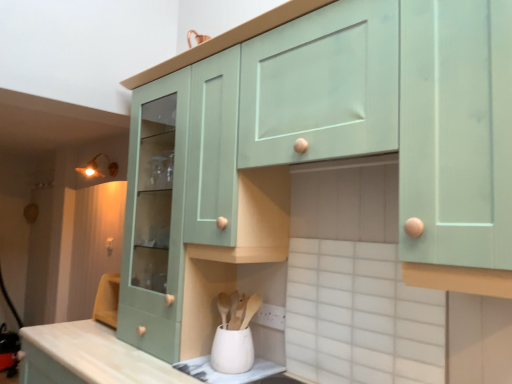
Question: Which direction should I rotate to look at mint green wood cabinet at center, positioned as the second cabinetry in right-to-left order, — up or down?

Choices:
 (A) up
 (B) down

Answer: (B)

Question: Is white ceramic tile at lower center positioned beyond the bounds of white matte utensil holder at lower center?

Choices:
 (A) no
 (B) yes

Answer: (B)

Question: Is white ceramic tile at lower center facing towards white matte utensil holder at lower center?

Choices:
 (A) no
 (B) yes

Answer: (A)

Question: Does white ceramic tile at lower center have a smaller size compared to white matte utensil holder at lower center?

Choices:
 (A) no
 (B) yes

Answer: (A)

Question: Is white matte utensil holder at lower center at the back of white ceramic tile at lower center?

Choices:
 (A) no
 (B) yes

Answer: (A)

Question: Can you confirm if white ceramic tile at lower center is shorter than white matte utensil holder at lower center?

Choices:
 (A) yes
 (B) no

Answer: (B)

Question: Is white ceramic tile at lower center further to camera compared to white matte utensil holder at lower center?

Choices:
 (A) yes
 (B) no

Answer: (B)

Question: From a real-world perspective, is mint green wood cabinet at upper center, acting as the 1th cabinetry starting from the right, over mint green wood cabinet at center, the 1th cabinetry in the left-to-right sequence?

Choices:
 (A) no
 (B) yes

Answer: (B)

Question: From a real-world perspective, is mint green wood cabinet at upper center, the second cabinetry viewed from the left, located beneath mint green wood cabinet at center, positioned as the second cabinetry in right-to-left order?

Choices:
 (A) yes
 (B) no

Answer: (B)

Question: Considering the relative sizes of mint green wood cabinet at upper center, acting as the 1th cabinetry starting from the right, and mint green wood cabinet at center, the 1th cabinetry in the left-to-right sequence, in the image provided, is mint green wood cabinet at upper center, acting as the 1th cabinetry starting from the right, wider than mint green wood cabinet at center, the 1th cabinetry in the left-to-right sequence,?

Choices:
 (A) no
 (B) yes

Answer: (A)

Question: Considering the relative sizes of mint green wood cabinet at upper center, acting as the 1th cabinetry starting from the right, and mint green wood cabinet at center, positioned as the second cabinetry in right-to-left order, in the image provided, is mint green wood cabinet at upper center, acting as the 1th cabinetry starting from the right, smaller than mint green wood cabinet at center, positioned as the second cabinetry in right-to-left order,?

Choices:
 (A) no
 (B) yes

Answer: (A)

Question: Does mint green wood cabinet at upper center, the second cabinetry viewed from the left, have a lesser height compared to mint green wood cabinet at center, positioned as the second cabinetry in right-to-left order?

Choices:
 (A) no
 (B) yes

Answer: (B)

Question: From the image's perspective, does mint green wood cabinet at upper center, the second cabinetry viewed from the left, appear lower than mint green wood cabinet at center, positioned as the second cabinetry in right-to-left order?

Choices:
 (A) no
 (B) yes

Answer: (A)

Question: Does white matte utensil holder at lower center have a greater height compared to matte brass light fixture at upper left?

Choices:
 (A) no
 (B) yes

Answer: (A)